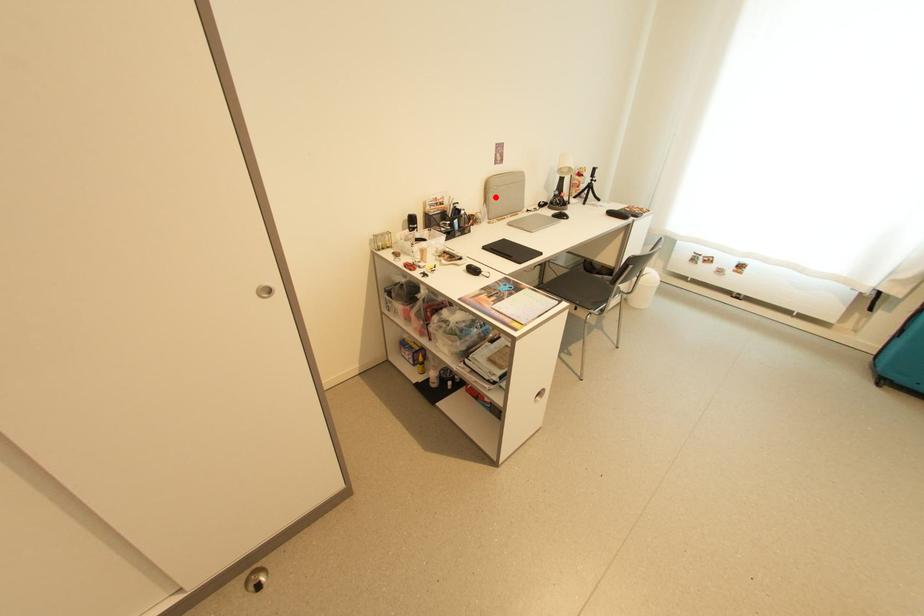
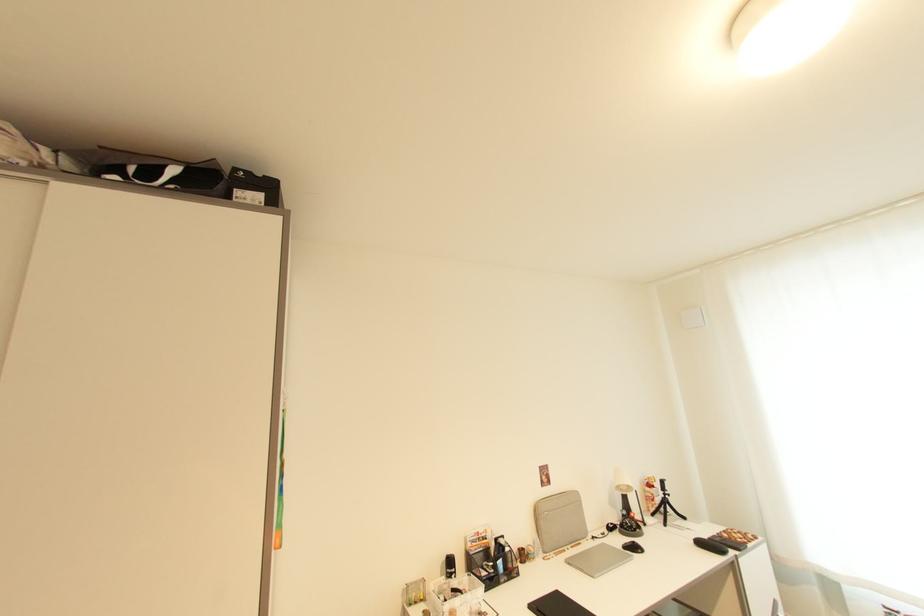
Locate, in the second image, the point that corresponds to the highlighted location in the first image.

(546, 525)